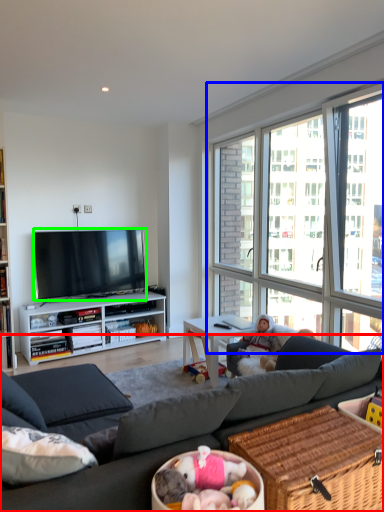
Question: Which object is positioned farthest from studio couch (highlighted by a red box)? Select from window (highlighted by a blue box) and television (highlighted by a green box).

Choices:
 (A) window
 (B) television

Answer: (A)